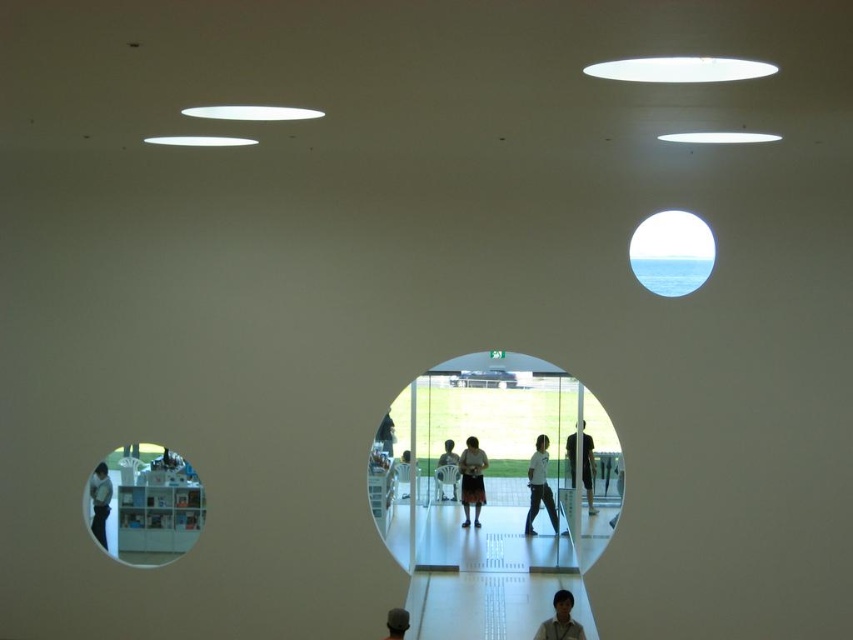
What is the 2D coordinate of the light brown hair at lower center in the image?

The light brown hair at lower center is located at the 2D coordinate point of (560, 620).

You are a photographer positioned at the entrance of the room. You see the light brown hair at lower center and the white shirt at left. Which object is closer to you?

The light brown hair at lower center is closer to you because it is in front of the white shirt at left.